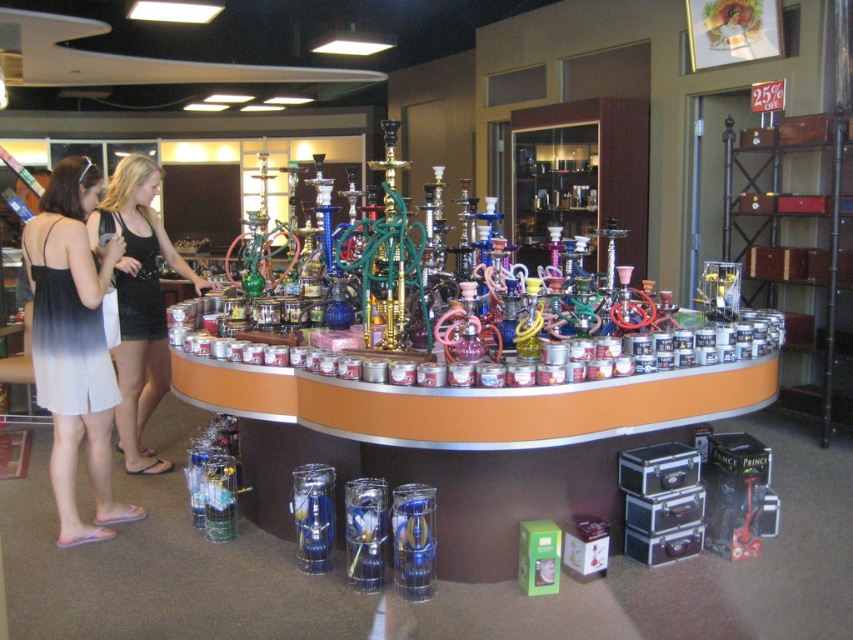
Question: Is white fabric dress at left to the right of black dress at left from the viewer's perspective?

Choices:
 (A) no
 (B) yes

Answer: (B)

Question: Can you confirm if white fabric dress at left is positioned above black dress at left?

Choices:
 (A) no
 (B) yes

Answer: (A)

Question: Is white fabric dress at left below black dress at left?

Choices:
 (A) no
 (B) yes

Answer: (B)

Question: Which of the following is the closest to the observer?

Choices:
 (A) (55, 490)
 (B) (148, 170)

Answer: (A)